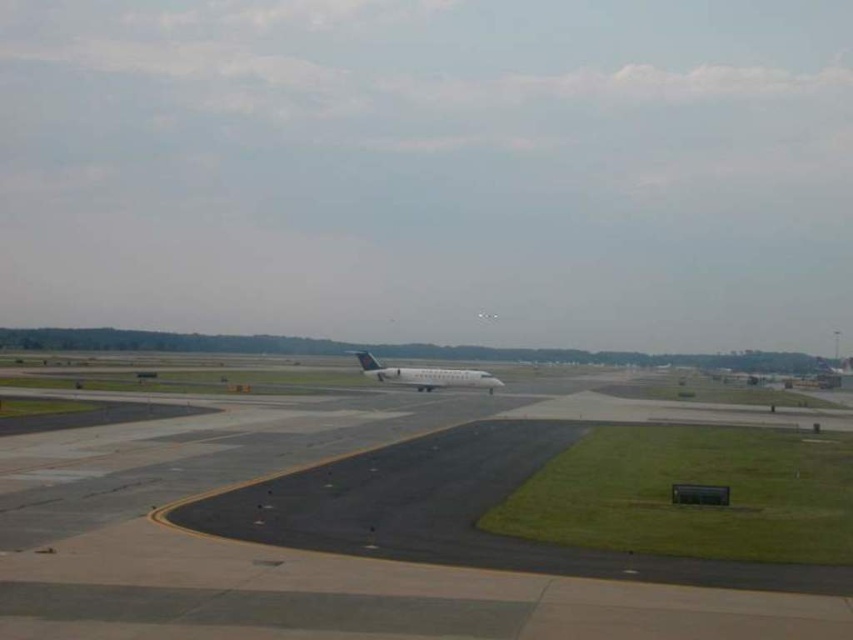
You are standing at the point marked by the coordinates point (318, 552). What material are you standing on?

The point (318, 552) marks black asphalt tarmac at center, so you are standing on black asphalt tarmac.

In the scene shown: You are a ground crew member who needs to inspect the black asphalt tarmac at center and the white matte airplane at center. The safety protocol requires you to maintain a minimum distance of 50 feet between yourself and any aircraft. If you stand exactly halfway between the two, will you be in compliance with the safety protocol?

The black asphalt tarmac at center is 52.40 feet from the white matte airplane at center. Halfway between them would be at 26.20 feet from the airplane, which is less than the required 50 feet. Therefore, standing halfway would violate the safety protocol.